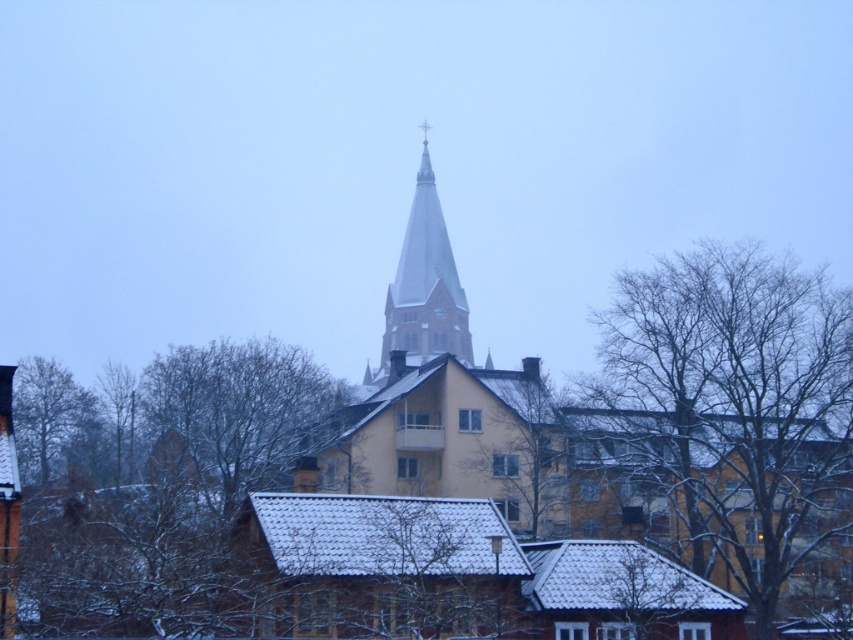
Between bare branches at upper center and green leafy tree at lower left, which one appears on the right side from the viewer's perspective?

bare branches at upper center is more to the right.

Is bare branches at upper center positioned before green leafy tree at lower left?

No, bare branches at upper center is behind green leafy tree at lower left.

Locate an element on the screen. Image resolution: width=853 pixels, height=640 pixels. bare branches at upper center is located at coordinates (735, 406).

Does point (495, 424) come in front of point (96, 404)?

That is True.

Image resolution: width=853 pixels, height=640 pixels. What do you see at coordinates (525, 448) in the screenshot? I see `bare branches at center` at bounding box center [525, 448].

You are a GUI agent. You are given a task and a screenshot of the screen. Output one action in this format:
    pyautogui.click(x=<x>, y=<y>)
    Task: Click on the bare branches at center
    
    Given the screenshot: What is the action you would take?
    pyautogui.click(x=525, y=448)

In the scene shown: Does smooth gray steeple at center have a smaller size compared to green leafy tree at lower left?

Correct, smooth gray steeple at center occupies less space than green leafy tree at lower left.

Is smooth gray steeple at center positioned before green leafy tree at lower left?

No, smooth gray steeple at center is further to the viewer.

Where is `smooth gray steeple at center`? This screenshot has width=853, height=640. smooth gray steeple at center is located at coordinates tap(425, 284).

Find the location of `smooth gray steeple at center`. smooth gray steeple at center is located at coordinates (425, 284).